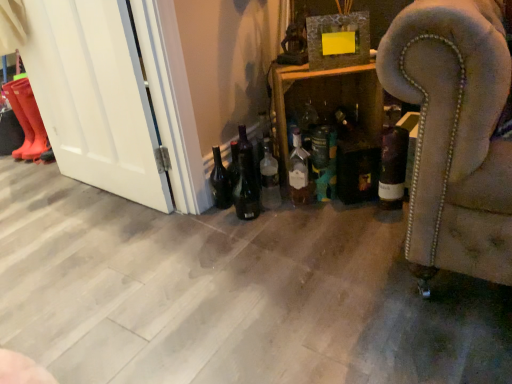
Identify the location of vacant region to the left of white glossy door at left. The height and width of the screenshot is (384, 512). (51, 195).